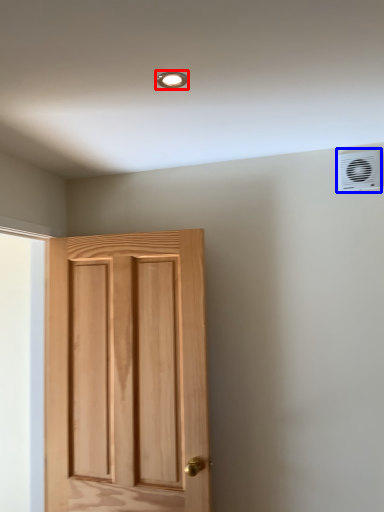
Question: Which object appears closest to the camera in this image, light fixture (highlighted by a red box) or air conditioning (highlighted by a blue box)?

Choices:
 (A) light fixture
 (B) air conditioning

Answer: (A)